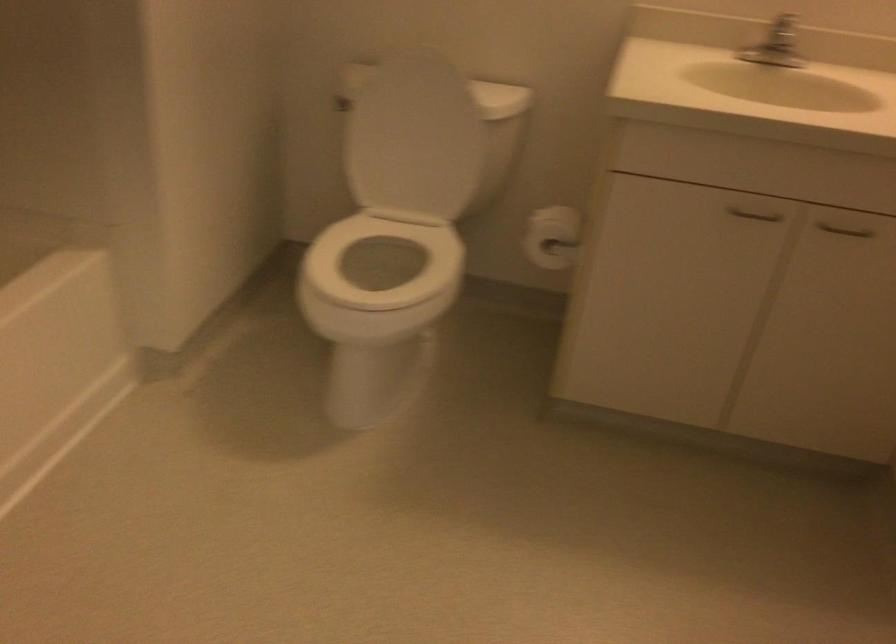
At what (x,y) coordinates should I click in order to perform the action: click on white toilet lid. Please return your answer as a coordinate pair (x, y). This screenshot has height=644, width=896. Looking at the image, I should click on (440, 61).